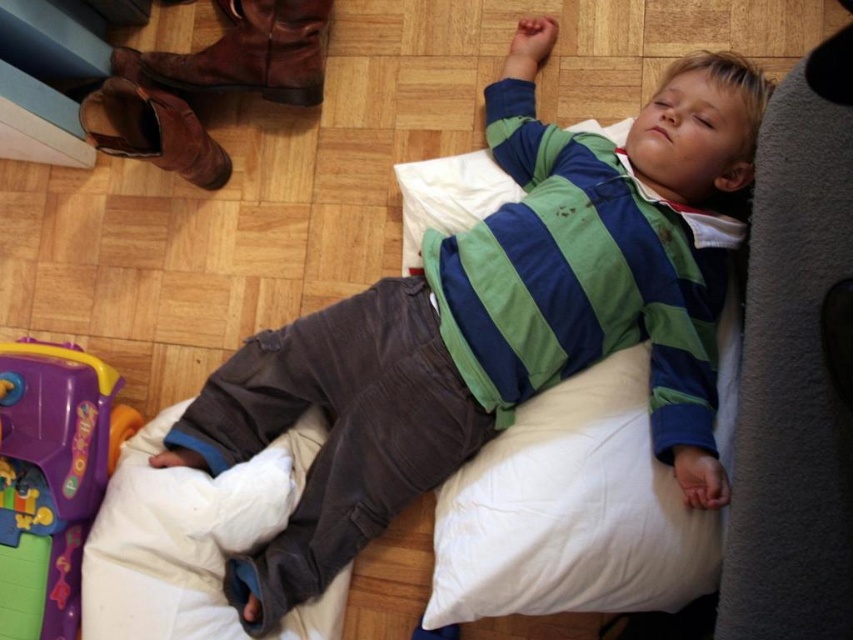
In the scene shown: You are a parent trying to reach for the purple plastic toy at lower left while your child is lying on the green striped shirt at center. Can you grab the toy without touching the child?

The green striped shirt at center and purple plastic toy at lower left are 14.23 inches apart from each other. Since the distance is more than a few inches, you can likely grab the toy without touching the child.

Consider the image. You are a photographer trying to capture a closeup of the purple plastic toy at lower left without the green striped shirt at center blocking the view. Can you do it based on their sizes?

The green striped shirt at center is larger in size than the purple plastic toy at lower left, so the shirt may block the view of the toy. You might need to adjust your angle or move closer to avoid the obstruction.

You are a parent trying to locate your child who is lying on the floor. You see the green striped shirt at center and the purple plastic toy at lower left. Which object is covering part of the other?

The green striped shirt at center is positioned over the purple plastic toy at lower left, so the shirt is covering part of the toy.